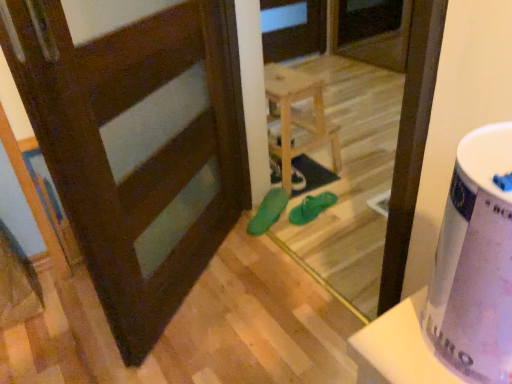
Find the location of a particular element. The image size is (512, 384). unoccupied region to the right of matte green shoe at center is located at coordinates (329, 181).